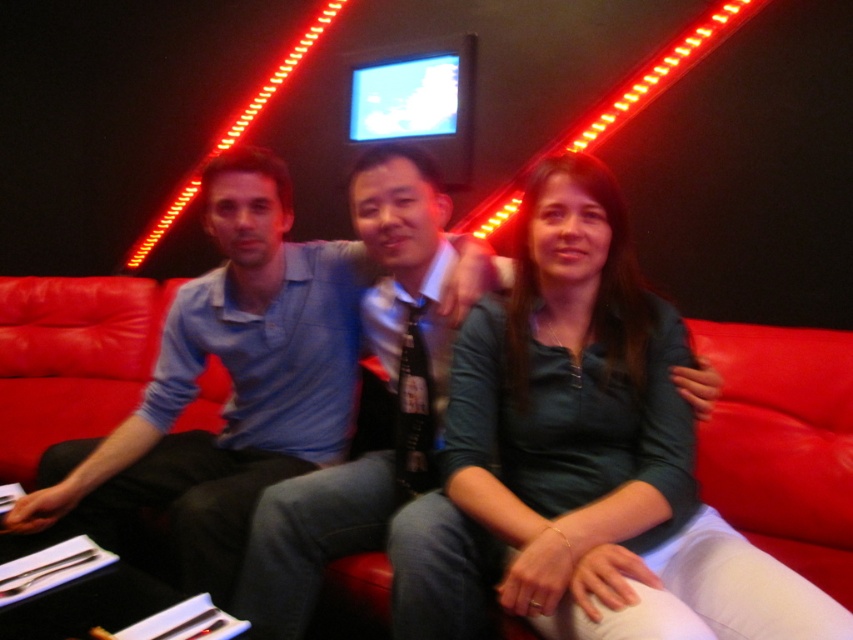
You are a photographer setting up a camera to capture the blue shirt at center and the red leather couch at center. Based on their sizes, which object should you focus on first if you want to ensure both are in frame without moving the camera?

The blue shirt at center has a smaller size compared to the red leather couch at center. To ensure both are in frame, focus on the larger object first, which is the red leather couch at center, then adjust to include the smaller blue shirt at center.

You are a photographer taking a group photo of the three people on the vibrant red leather couch. You want to ensure that the matte green shirt at center and the blue shirt at center are aligned properly in the frame. Which shirt should you adjust to the left to make them centered between each other?

The matte green shirt at center is positioned on the right side of blue shirt at center. To center them between each other, you should move the matte green shirt at center slightly to the left so it aligns centrally with the blue shirt at center.